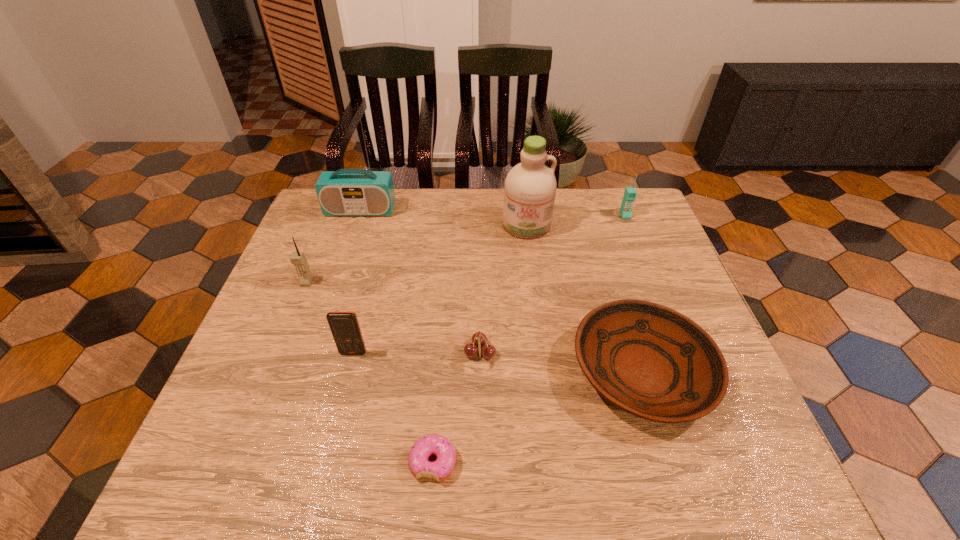
The width and height of the screenshot is (960, 540). Find the location of `vacant area that lies between the doughnut and the plate`. vacant area that lies between the doughnut and the plate is located at coordinates point(538,417).

You are a GUI agent. You are given a task and a screenshot of the screen. Output one action in this format:
    pyautogui.click(x=<x>, y=<y>)
    Task: Click on the empty space between the seventh shortest object and the fifth object from left to right
    Image resolution: width=960 pixels, height=540 pixels.
    Given the screenshot: What is the action you would take?
    pyautogui.click(x=503, y=289)

The height and width of the screenshot is (540, 960). Find the location of `free space between the leftmost cellular telephone and the radio receiver`. free space between the leftmost cellular telephone and the radio receiver is located at coordinates (333, 246).

Identify the location of object identified as the closest to the rightmost cellular telephone. The height and width of the screenshot is (540, 960). (530, 187).

The height and width of the screenshot is (540, 960). What are the coordinates of `object that is the closest to the radio receiver` in the screenshot? It's located at (299, 260).

Select which cellular telephone is the closest to the leftmost cellular telephone. Please provide its 2D coordinates. Your answer should be formatted as a tuple, i.e. [(x, y)], where the tuple contains the x and y coordinates of a point satisfying the conditions above.

[(344, 326)]

Locate an element on the screen. This screenshot has width=960, height=540. cellular telephone identified as the third closest to the second tallest object is located at coordinates (299, 260).

At what (x,y) coordinates should I click in order to perform the action: click on free space that satisfies the following two spatial constraints: 1. on the back side of the plate; 2. on the leaves of the cherry. Please return your answer as a coordinate pair (x, y). This screenshot has height=540, width=960. Looking at the image, I should click on (636, 353).

The image size is (960, 540). In order to click on free spot that satisfies the following two spatial constraints: 1. on the front of the shortest object, where the keypad is located; 2. on the right side of the second farthest cellular telephone in this screenshot , I will do `click(234, 462)`.

You are a GUI agent. You are given a task and a screenshot of the screen. Output one action in this format:
    pyautogui.click(x=<x>, y=<y>)
    Task: Click on the vacant space that satisfies the following two spatial constraints: 1. on the screen of the plate; 2. on the right side of the nearest cellular telephone
    This screenshot has height=540, width=960.
    Given the screenshot: What is the action you would take?
    pyautogui.click(x=348, y=372)